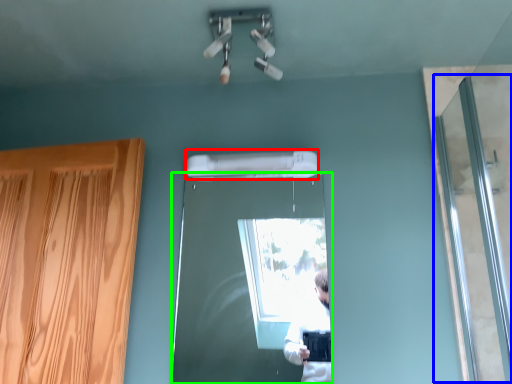
Question: Which object is the farthest from air conditioner (highlighted by a red box)? Choose among these: screen door (highlighted by a blue box) or door (highlighted by a green box).

Choices:
 (A) screen door
 (B) door

Answer: (B)